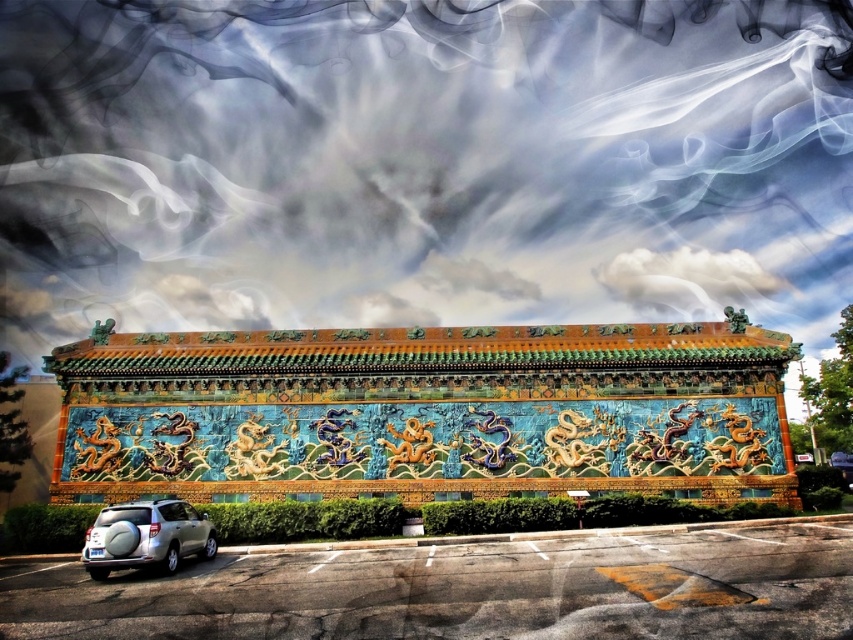
Question: Does shiny ceramic wall at center have a smaller size compared to satin silver suv at lower left?

Choices:
 (A) yes
 (B) no

Answer: (B)

Question: Does shiny ceramic wall at center appear under satin silver suv at lower left?

Choices:
 (A) no
 (B) yes

Answer: (A)

Question: Which point appears farthest from the camera in this image?

Choices:
 (A) (65, 388)
 (B) (206, 525)

Answer: (A)

Question: Is shiny ceramic wall at center below satin silver suv at lower left?

Choices:
 (A) no
 (B) yes

Answer: (A)

Question: Which point is closer to the camera taking this photo?

Choices:
 (A) (189, 520)
 (B) (793, 483)

Answer: (A)